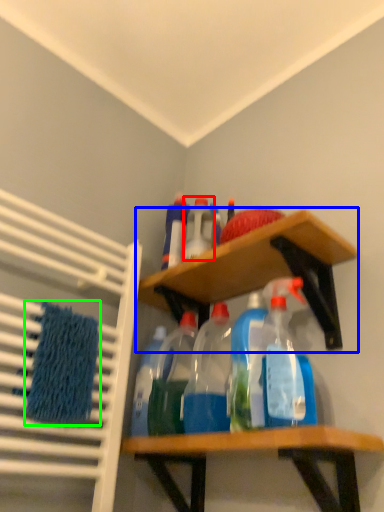
Question: Estimate the real-world distances between objects in this image. Which object is closer to bottle (highlighted by a red box), shelf (highlighted by a blue box) or bath towel (highlighted by a green box)?

Choices:
 (A) shelf
 (B) bath towel

Answer: (A)